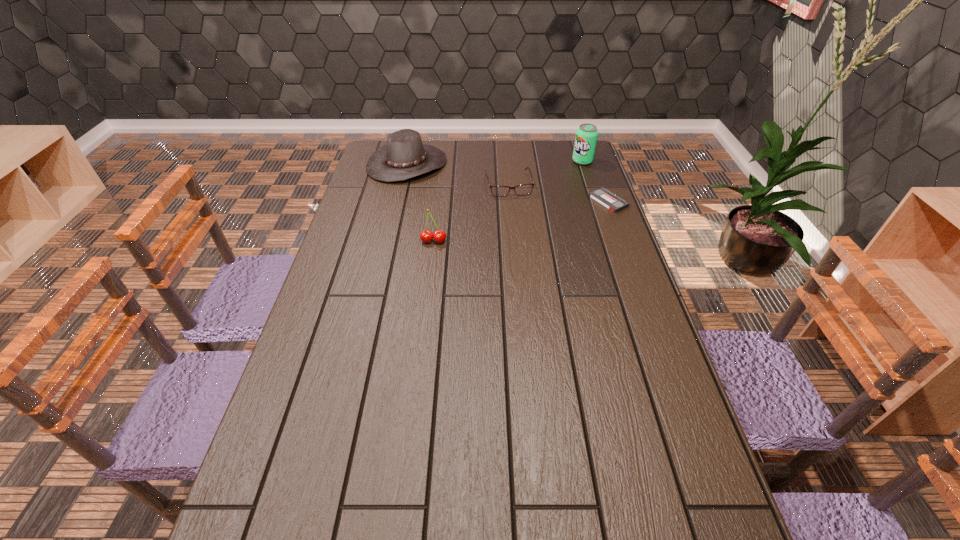
The height and width of the screenshot is (540, 960). What are the coordinates of `the nearest object` in the screenshot? It's located at (439, 236).

This screenshot has height=540, width=960. Identify the location of the shortest object. [614, 203].

Where is `the tallest object`? This screenshot has width=960, height=540. the tallest object is located at coordinates (586, 135).

At what (x,y) coordinates should I click in order to perform the action: click on the third object from left to right. Please return your answer as a coordinate pair (x, y). This screenshot has width=960, height=540. Looking at the image, I should click on (499, 191).

Identify the location of spectacles. Image resolution: width=960 pixels, height=540 pixels. (499, 191).

The image size is (960, 540). I want to click on hat, so click(404, 156).

The image size is (960, 540). I want to click on vacant space positioned 0.250m with the stems of the cherry pointing upwards, so click(426, 303).

Where is `blank space located 0.240m on the back of the videotape`? The height and width of the screenshot is (540, 960). blank space located 0.240m on the back of the videotape is located at coordinates (592, 158).

The width and height of the screenshot is (960, 540). I want to click on free spot located 0.340m on the front-facing side of the pop soda, so pyautogui.click(x=532, y=204).

At what (x,y) coordinates should I click in order to perform the action: click on vacant region located on the front-facing side of the pop soda. Please return your answer as a coordinate pair (x, y). The height and width of the screenshot is (540, 960). Looking at the image, I should click on (526, 210).